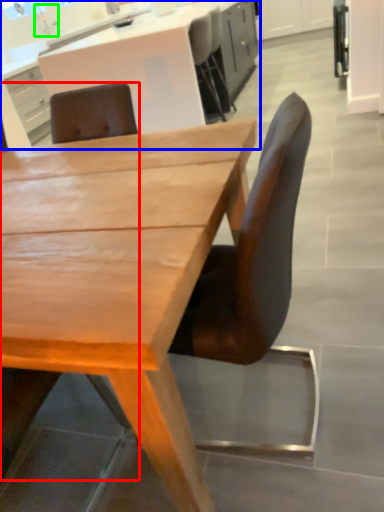
Question: Estimate the real-world distances between objects in this image. Which object is closer to chair (highlighted by a red box), cabinetry (highlighted by a blue box) or faucet (highlighted by a green box)?

Choices:
 (A) cabinetry
 (B) faucet

Answer: (B)